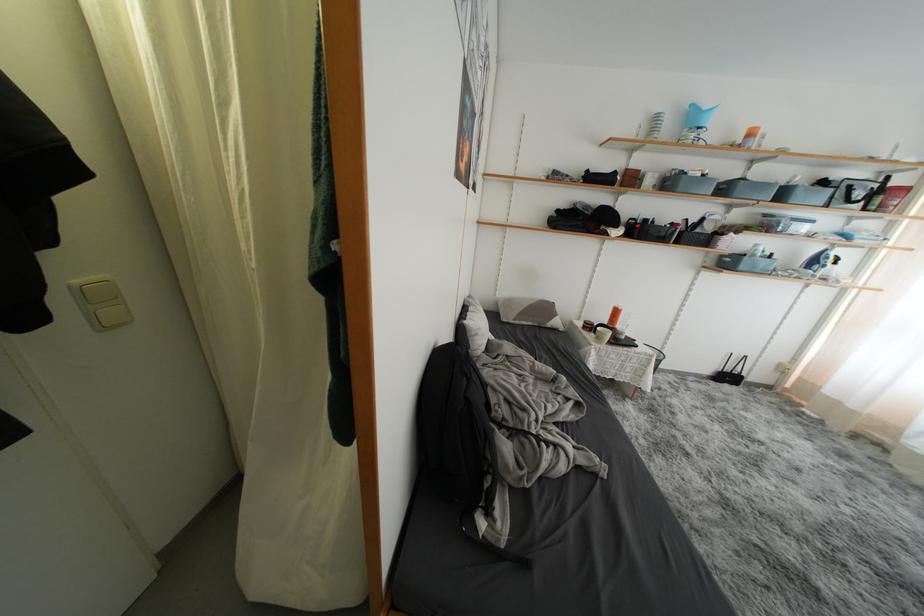
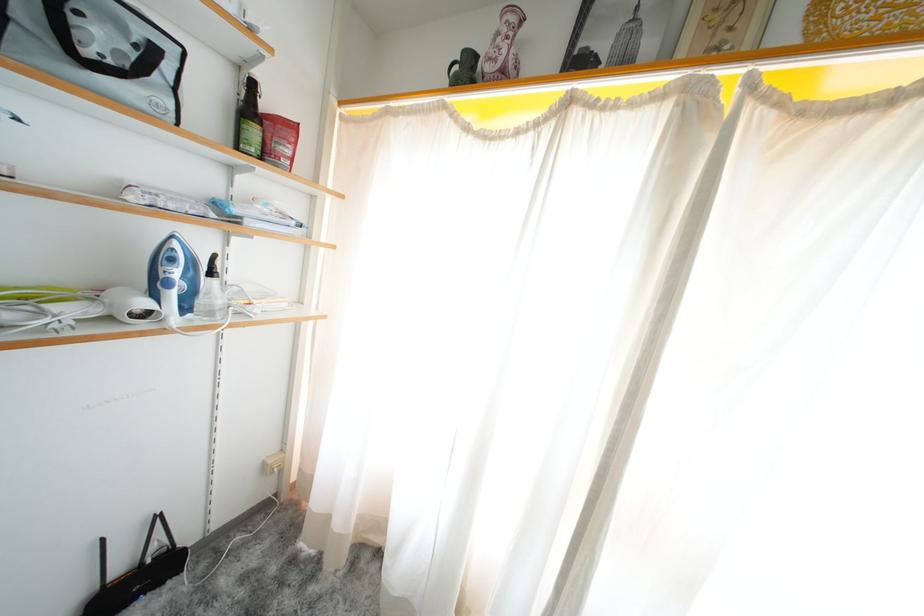
Where in the second image is the point corresponding to the point at 807,383 from the first image?

(306, 475)